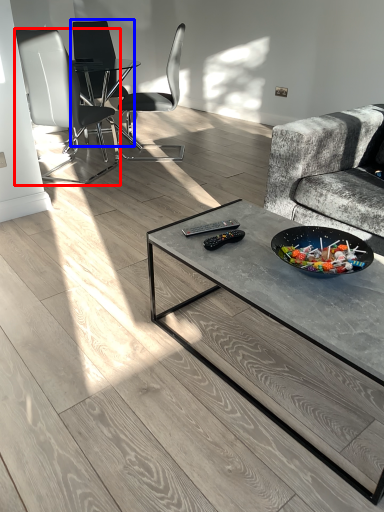
Question: Which point is closer to the camera, chair (highlighted by a red box) or chair (highlighted by a blue box)?

Choices:
 (A) chair
 (B) chair

Answer: (A)